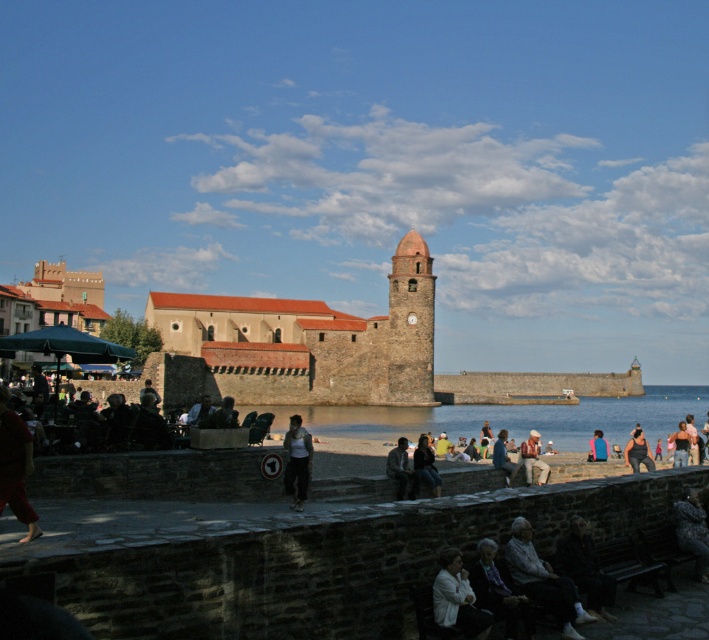
Question: Which point appears closest to the camera in this image?

Choices:
 (A) (510, 474)
 (B) (530, 449)
 (C) (440, 618)
 (D) (430, 484)

Answer: (C)

Question: Is brown stone fort at center in front of denim jacket at center?

Choices:
 (A) yes
 (B) no

Answer: (B)

Question: Considering the real-world distances, which object is farthest from the denim jacket at lower center?

Choices:
 (A) denim jacket at center
 (B) barefoot person at lower left
 (C) white matte jacket at lower center
 (D) white fabric jacket at lower center

Answer: (B)

Question: Does white matte jacket at lower center have a smaller size compared to light brown leather jacket at center?

Choices:
 (A) yes
 (B) no

Answer: (A)

Question: Is brown stone fort at center smaller than dark gray fabric jacket at center?

Choices:
 (A) yes
 (B) no

Answer: (B)

Question: Which object is farther from the camera taking this photo?

Choices:
 (A) white cotton shirt at center
 (B) brown stone fort at center
 (C) white matte jacket at lower center

Answer: (B)